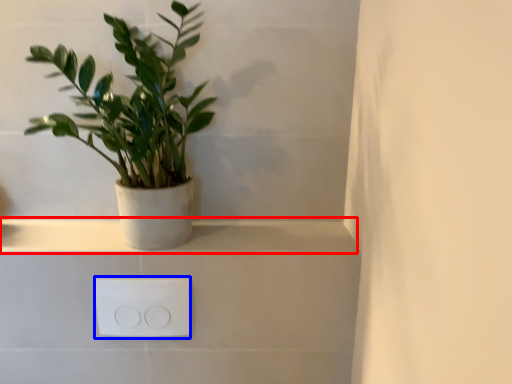
Question: Which object appears farthest to the camera in this image, window sill (highlighted by a red box) or electric outlet (highlighted by a blue box)?

Choices:
 (A) window sill
 (B) electric outlet

Answer: (A)